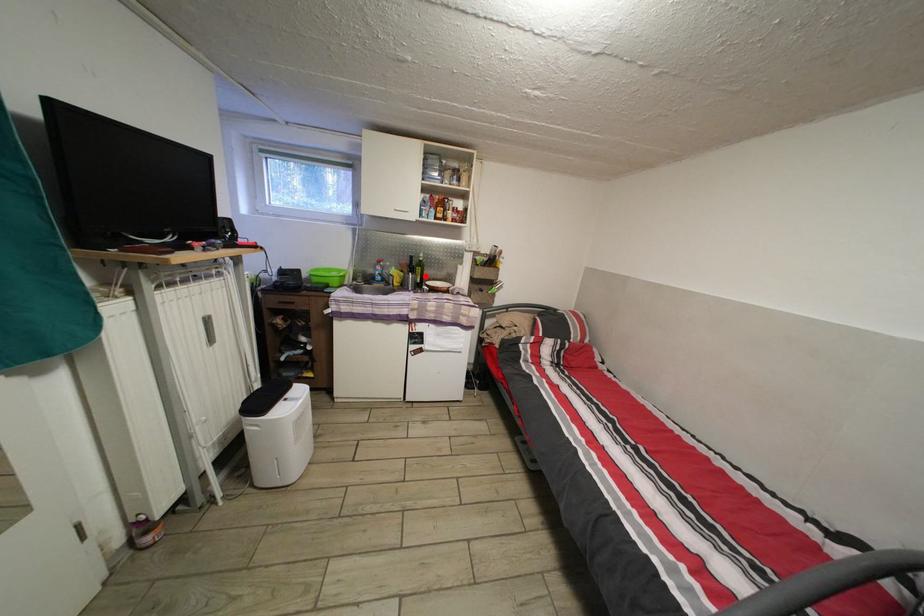
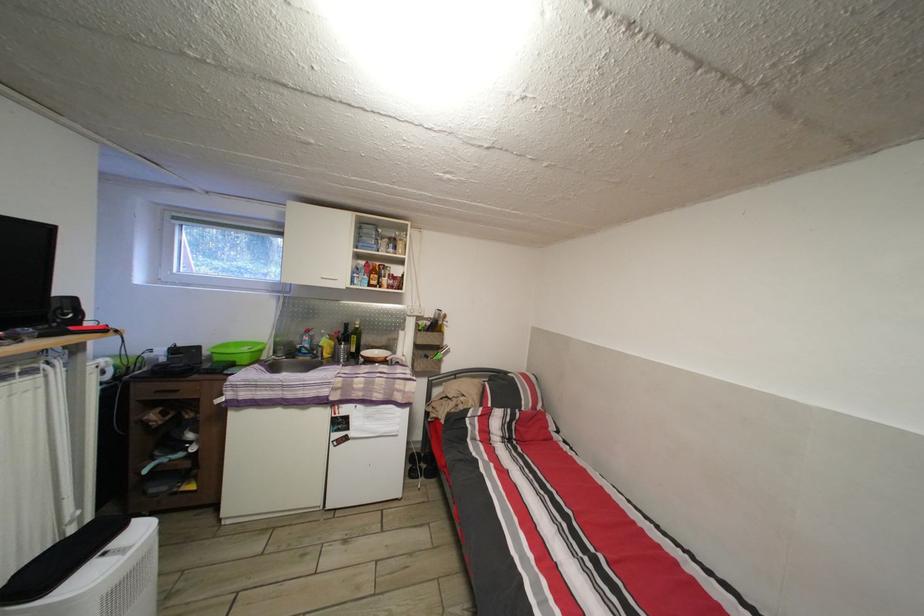
Where in the second image is the point corresponding to the highlighted location from the first image?

(360, 345)